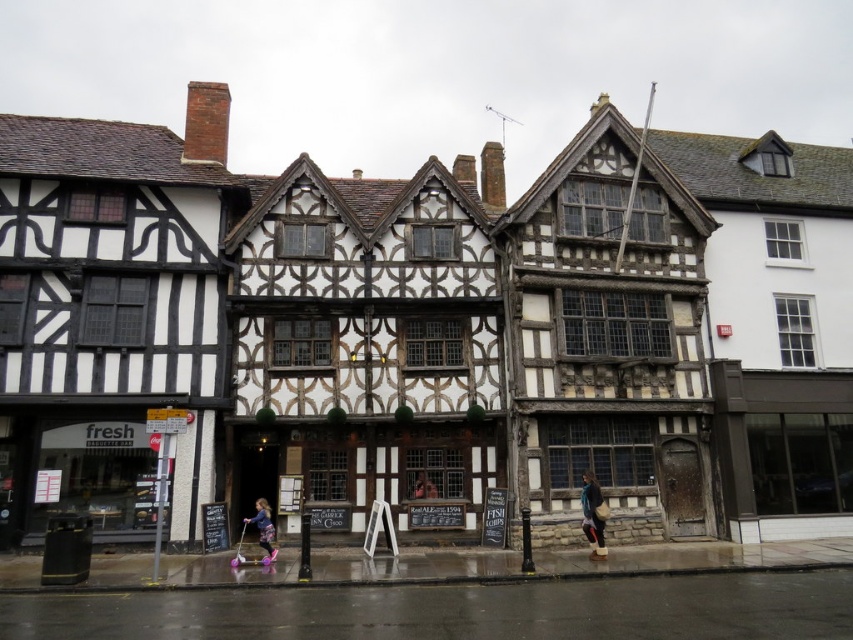
Does blue denim jacket at center have a greater width compared to pink fabric pants at lower center?

No, blue denim jacket at center is not wider than pink fabric pants at lower center.

Does blue denim jacket at center have a smaller size compared to pink fabric pants at lower center?

Actually, blue denim jacket at center might be larger than pink fabric pants at lower center.

Identify the location of blue denim jacket at center. (593, 515).